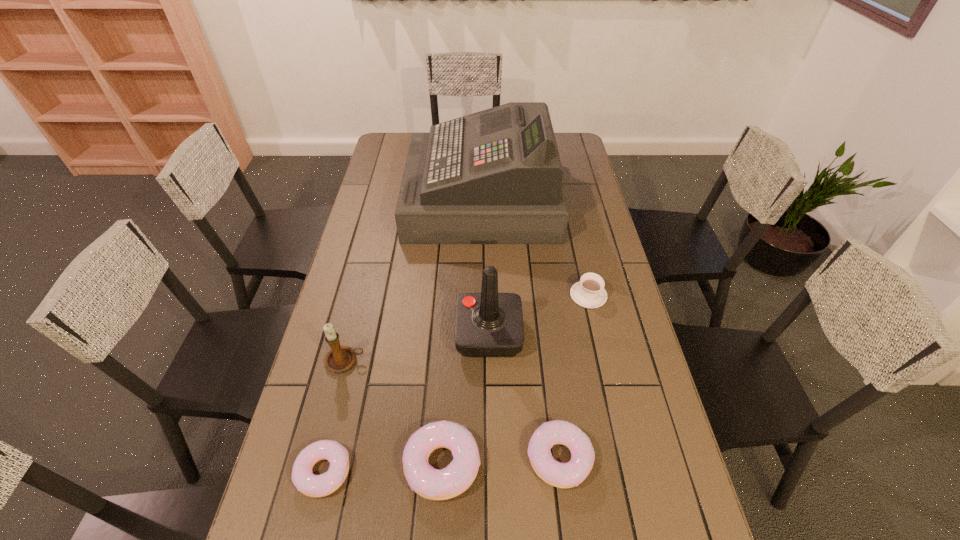
Where is `vacant area in the image that satisfies the following two spatial constraints: 1. on the handle side of the teacup; 2. on the front-facing side of the tallest object`? Image resolution: width=960 pixels, height=540 pixels. vacant area in the image that satisfies the following two spatial constraints: 1. on the handle side of the teacup; 2. on the front-facing side of the tallest object is located at coordinates click(566, 198).

You are a GUI agent. You are given a task and a screenshot of the screen. Output one action in this format:
    pyautogui.click(x=<x>, y=<y>)
    Task: Click on the free region that satisfies the following two spatial constraints: 1. on the side of the candle holder with the handle; 2. on the right side of the second shortest doughnut
    The width and height of the screenshot is (960, 540).
    Given the screenshot: What is the action you would take?
    pyautogui.click(x=322, y=457)

Where is `vacant area in the image that satisfies the following two spatial constraints: 1. on the side of the third tallest object with the handle; 2. on the left side of the second doughnut from right to left`? This screenshot has width=960, height=540. vacant area in the image that satisfies the following two spatial constraints: 1. on the side of the third tallest object with the handle; 2. on the left side of the second doughnut from right to left is located at coordinates (320, 464).

I want to click on free space that satisfies the following two spatial constraints: 1. on the side of the candle holder with the handle; 2. on the back side of the shortest object, so click(x=318, y=471).

Where is `vacant space that satisfies the following two spatial constraints: 1. on the front-facing side of the farthest object; 2. on the handle side of the second farthest object`? This screenshot has height=540, width=960. vacant space that satisfies the following two spatial constraints: 1. on the front-facing side of the farthest object; 2. on the handle side of the second farthest object is located at coordinates (482, 295).

The image size is (960, 540). I want to click on free space in the image that satisfies the following two spatial constraints: 1. on the front-facing side of the second tallest object; 2. on the left side of the cash register, so click(482, 334).

Image resolution: width=960 pixels, height=540 pixels. In order to click on vacant space that satisfies the following two spatial constraints: 1. on the side of the candle holder with the handle; 2. on the right side of the second doughnut from left to right in this screenshot , I will do `click(320, 464)`.